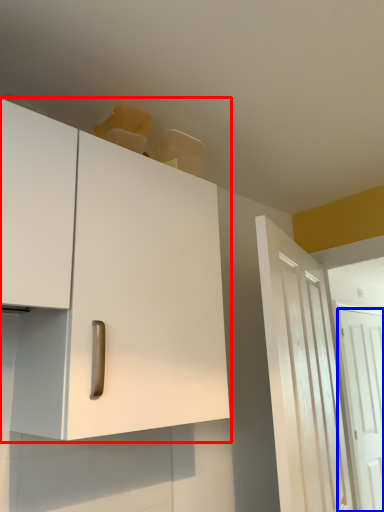
Question: Which point is further to the camera, cabinetry (highlighted by a red box) or door (highlighted by a blue box)?

Choices:
 (A) cabinetry
 (B) door

Answer: (B)